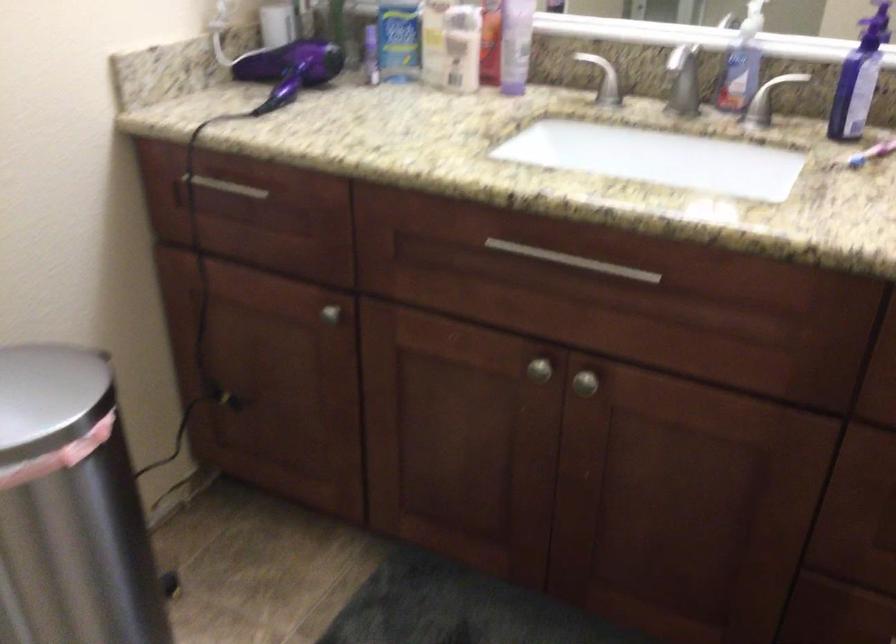
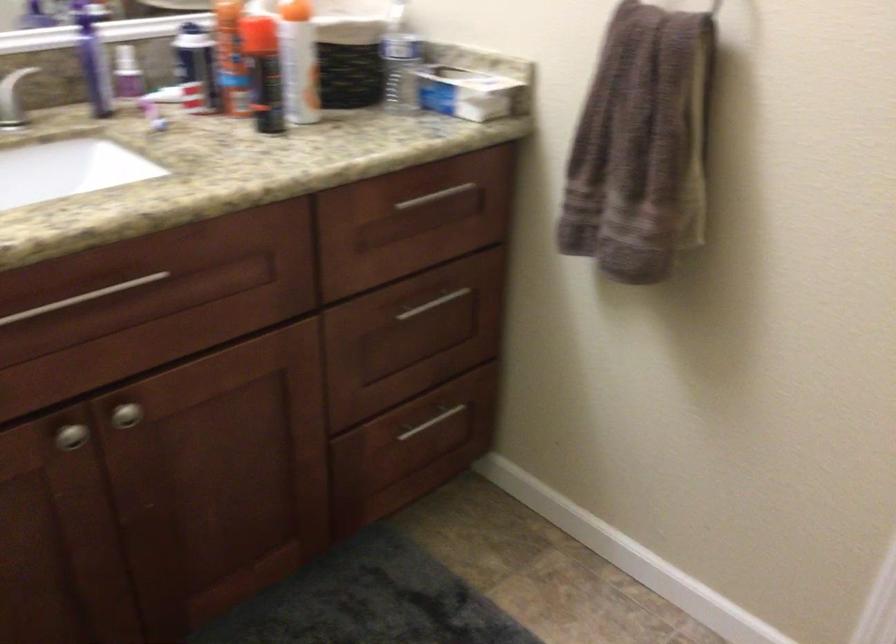
In the second image, find the point that corresponds to (x=582, y=261) in the first image.

(82, 298)